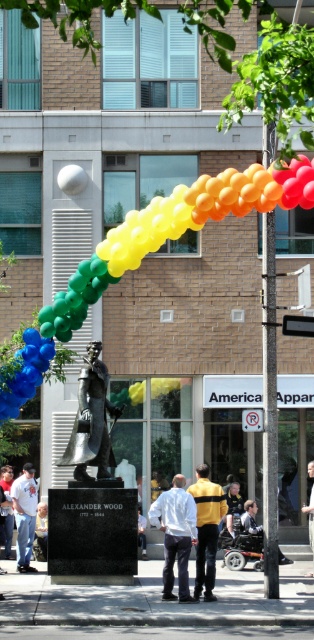
From the picture: Is white matte shirt at center taller than white shirt at lower left?

Indeed, white matte shirt at center has a greater height compared to white shirt at lower left.

Between point (187, 532) and point (6, 468), which one is positioned in front?

Point (187, 532) is more forward.

The image size is (314, 640). Find the location of `white matte shirt at center`. white matte shirt at center is located at coordinates (176, 534).

Can you confirm if green matte balloons at center is positioned below white shirt at lower left?

Actually, green matte balloons at center is above white shirt at lower left.

Which is behind, point (79, 320) or point (4, 513)?

Positioned behind is point (4, 513).

At what (x,y) coordinates should I click in order to perform the action: click on green matte balloons at center. Please return your answer as a coordinate pair (x, y). Looking at the image, I should click on [173, 230].

Which is below, white matte shirt at center or white cotton shirt at lower left?

white cotton shirt at lower left

The height and width of the screenshot is (640, 314). What do you see at coordinates (176, 534) in the screenshot?
I see `white matte shirt at center` at bounding box center [176, 534].

Where is `white matte shirt at center`? white matte shirt at center is located at coordinates (176, 534).